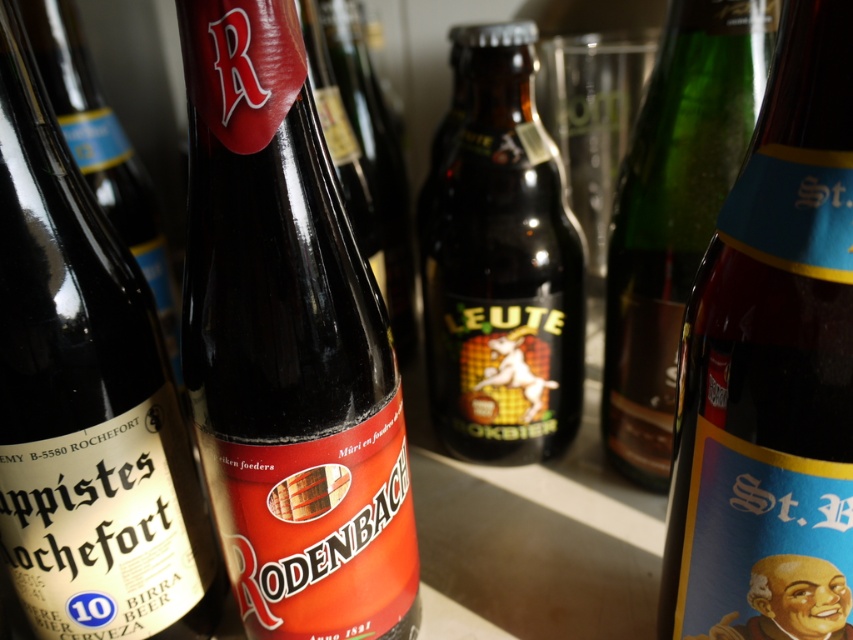
Between shiny dark glass bottle at center and matte black bottle at center, which one has more height?

With more height is matte black bottle at center.

The width and height of the screenshot is (853, 640). In order to click on shiny dark glass bottle at center in this screenshot , I will do `click(287, 346)`.

Based on the photo, does matte black bottle at center appear under green glass bottle at center?

Indeed, matte black bottle at center is positioned under green glass bottle at center.

Can you confirm if matte black bottle at center is thinner than green glass bottle at center?

No, matte black bottle at center is not thinner than green glass bottle at center.

Is point (18, 470) closer to viewer compared to point (712, 52)?

Yes, it is.

The width and height of the screenshot is (853, 640). In order to click on matte black bottle at center in this screenshot , I will do 85,403.

Is shiny dark glass bottle at center wider than matte black bottle at left?

No.

Does shiny dark glass bottle at center have a lesser width compared to matte black bottle at left?

Indeed, shiny dark glass bottle at center has a lesser width compared to matte black bottle at left.

What do you see at coordinates (287, 346) in the screenshot?
I see `shiny dark glass bottle at center` at bounding box center [287, 346].

Find the location of a particular element. shiny dark glass bottle at center is located at coordinates (287, 346).